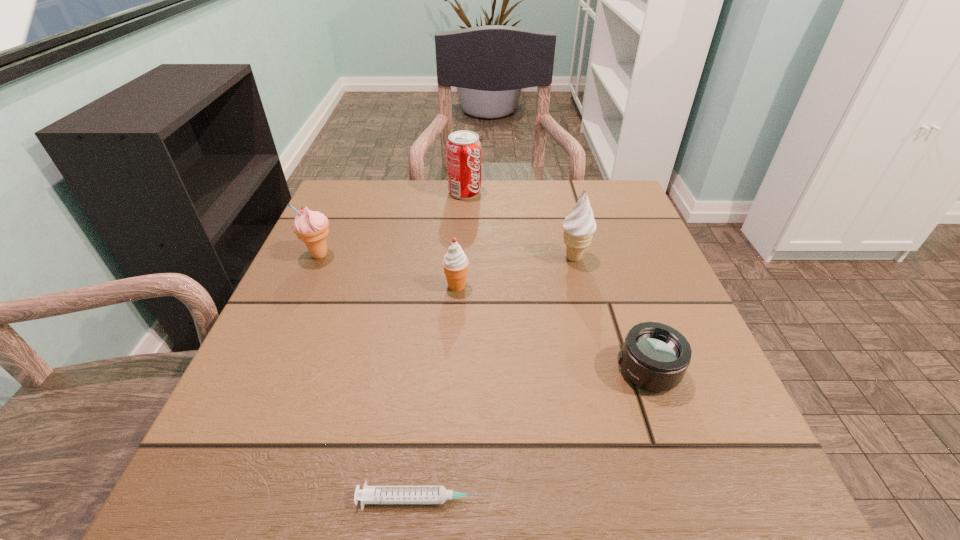
Find the location of `the fourth closest object to the leftmost object`. the fourth closest object to the leftmost object is located at coordinates (370, 494).

Identify which icecream is located as the second nearest to the leftmost icecream. Please provide its 2D coordinates. Your answer should be formatted as a tuple, i.e. [(x, y)], where the tuple contains the x and y coordinates of a point satisfying the conditions above.

[(579, 227)]

Choose which icecream is the third nearest neighbor to the farthest object. Please provide its 2D coordinates. Your answer should be formatted as a tuple, i.e. [(x, y)], where the tuple contains the x and y coordinates of a point satisfying the conditions above.

[(455, 262)]